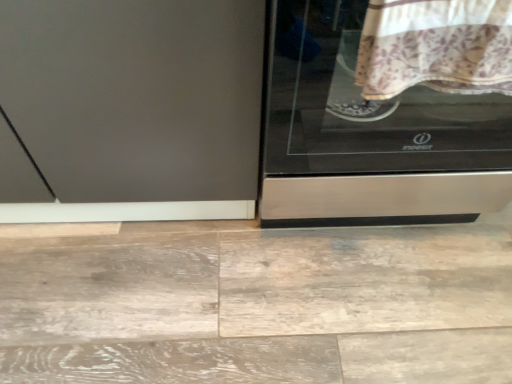
Question: Is floral cotton blanket at upper right bigger or smaller than stainless steel cooktop at right?

Choices:
 (A) small
 (B) big

Answer: (A)

Question: Is floral cotton blanket at upper right situated inside stainless steel cooktop at right or outside?

Choices:
 (A) outside
 (B) inside

Answer: (A)

Question: Based on their relative distances, which object is nearer to the matte gray screen door at left?

Choices:
 (A) stainless steel cooktop at right
 (B) floral cotton blanket at upper right

Answer: (A)

Question: Estimate the real-world distances between objects in this image. Which object is farther from the stainless steel cooktop at right?

Choices:
 (A) floral cotton blanket at upper right
 (B) matte gray screen door at left

Answer: (B)